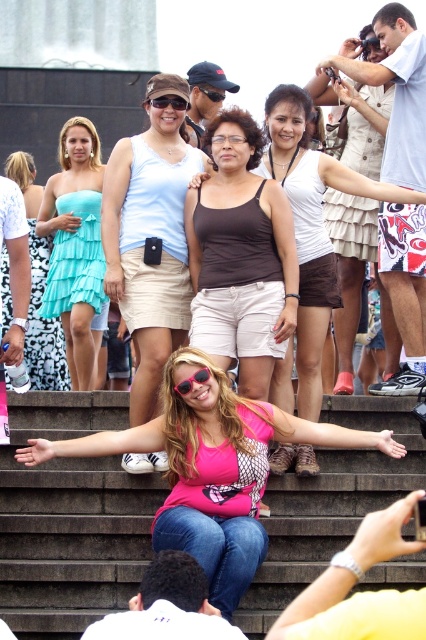
You are a photographer trying to capture a clear shot of both the pink matte sunglasses at center and the black plastic goggles at center. Since they are both at the center, you need to adjust your camera focus. Which object should you focus on first if you want to ensure the larger one is sharp?

The pink matte sunglasses at center has a larger size compared to the black plastic goggles at center, so you should focus on the pink matte sunglasses at center first to ensure it appears sharp in the photo.

You are standing at the position of the camera taking the photo of the group on the stone steps. If you want to focus on the point at point (232, 248) and point (215, 96), which point is closer to you?

Point (232, 248) is closer to the camera than point (215, 96).